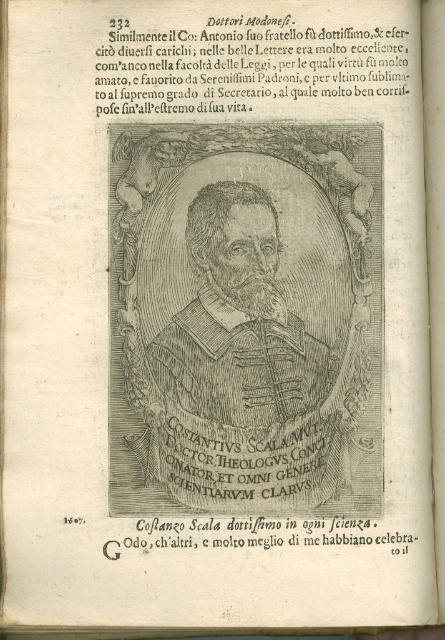
Question: Which object is closer to the camera taking this photo?

Choices:
 (A) black paper at lower center
 (B) black paper text at upper center
 (C) black engraving portrait at center

Answer: (C)

Question: Is black engraving portrait at center smaller than black paper text at upper center?

Choices:
 (A) yes
 (B) no

Answer: (B)

Question: Is black engraving portrait at center closer to the viewer compared to black paper text at upper center?

Choices:
 (A) no
 (B) yes

Answer: (B)

Question: Which object is positioned closest to the black engraving portrait at center?

Choices:
 (A) black paper text at upper center
 (B) black paper at lower center

Answer: (A)

Question: Estimate the real-world distances between objects in this image. Which object is farther from the black paper at lower center?

Choices:
 (A) black paper text at upper center
 (B) black engraving portrait at center

Answer: (A)

Question: Can you confirm if black engraving portrait at center is positioned above black paper at lower center?

Choices:
 (A) no
 (B) yes

Answer: (B)